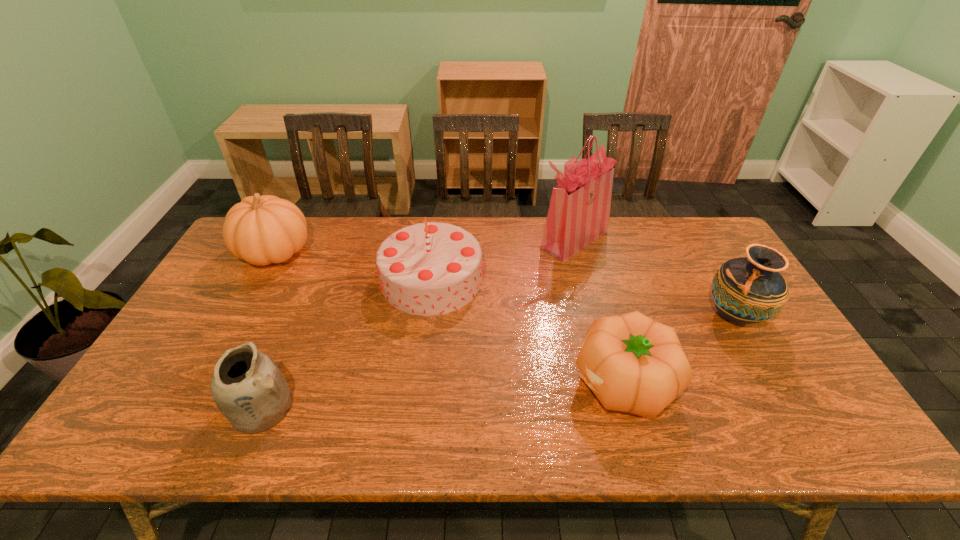
Identify the location of free spot between the nearer pumpkin and the nearer pottery. The width and height of the screenshot is (960, 540). (442, 395).

You are a GUI agent. You are given a task and a screenshot of the screen. Output one action in this format:
    pyautogui.click(x=<x>, y=<y>)
    Task: Click on the unoccupied position between the left pottery and the right pumpkin
    
    Given the screenshot: What is the action you would take?
    pyautogui.click(x=442, y=395)

Image resolution: width=960 pixels, height=540 pixels. In order to click on vacant area that lies between the farther pumpkin and the farther pottery in this screenshot , I will do click(504, 284).

Where is `vacant region between the left pumpkin and the birthday cake`? The image size is (960, 540). vacant region between the left pumpkin and the birthday cake is located at coordinates (353, 266).

Where is `unoccupied area between the right pottery and the left pottery`? Image resolution: width=960 pixels, height=540 pixels. unoccupied area between the right pottery and the left pottery is located at coordinates (498, 361).

Locate an element on the screen. free point between the birthday cake and the left pottery is located at coordinates (347, 343).

Find the location of a particular element. free space between the shopping bag and the left pottery is located at coordinates (418, 323).

Locate an element on the screen. free spot between the farther pumpkin and the shorter pumpkin is located at coordinates click(448, 318).

Image resolution: width=960 pixels, height=540 pixels. I want to click on the third closest object to the taller pottery, so click(x=426, y=269).

Identify which object is the third closest to the shorter pottery. Please provide its 2D coordinates. Your answer should be formatted as a tuple, i.e. [(x, y)], where the tuple contains the x and y coordinates of a point satisfying the conditions above.

[(633, 364)]